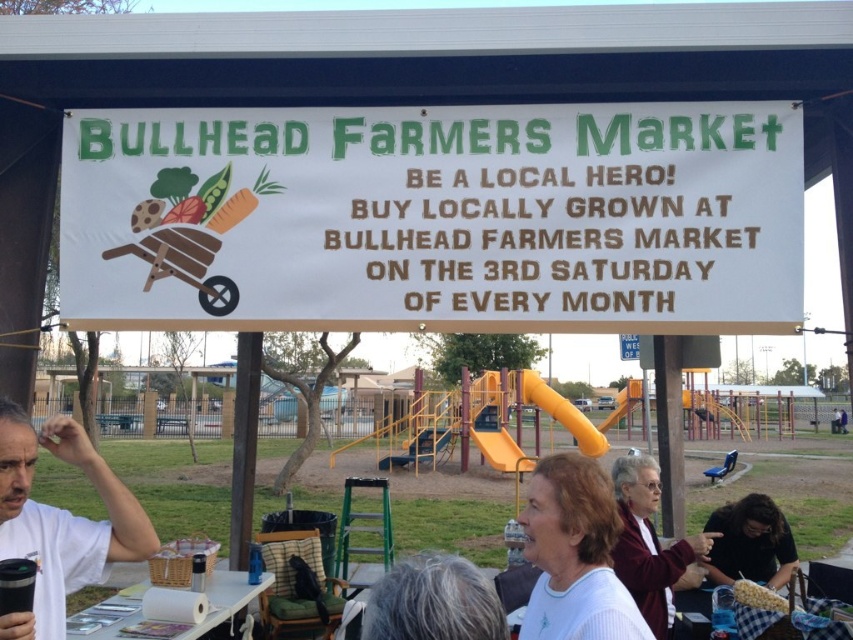
Question: Is white paper sign at center above dark brown hair at lower right?

Choices:
 (A) yes
 (B) no

Answer: (A)

Question: Which point is closer to the camera?

Choices:
 (A) (756, 584)
 (B) (109, 627)
 (C) (80, 316)

Answer: (C)

Question: Based on their relative distances, which object is farther from the maroon sweater at center?

Choices:
 (A) white striped shirt at lower center
 (B) white t-shirt at left
 (C) golden corn cob at lower right
 (D) white paper at lower center

Answer: (B)

Question: Can you confirm if white striped shirt at lower center is smaller than gray hair at upper center?

Choices:
 (A) no
 (B) yes

Answer: (A)

Question: Where is white striped shirt at lower center located in relation to dark brown hair at lower right in the image?

Choices:
 (A) left
 (B) right

Answer: (A)

Question: Which object is closer to the camera taking this photo?

Choices:
 (A) white t-shirt at left
 (B) white paper at lower center
 (C) dark brown hair at lower right

Answer: (A)